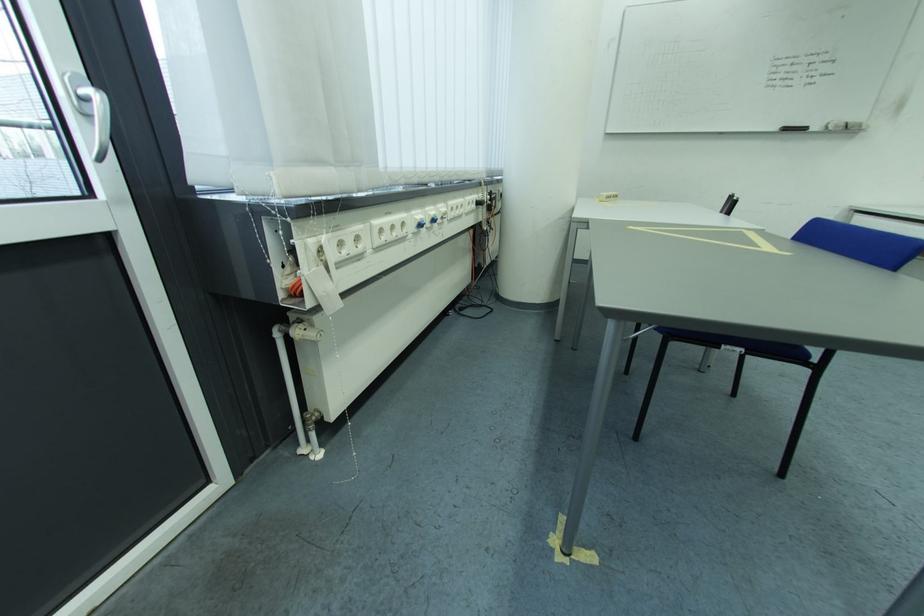
Find the location of a particular element. The height and width of the screenshot is (616, 924). radiator control knob is located at coordinates (304, 330).